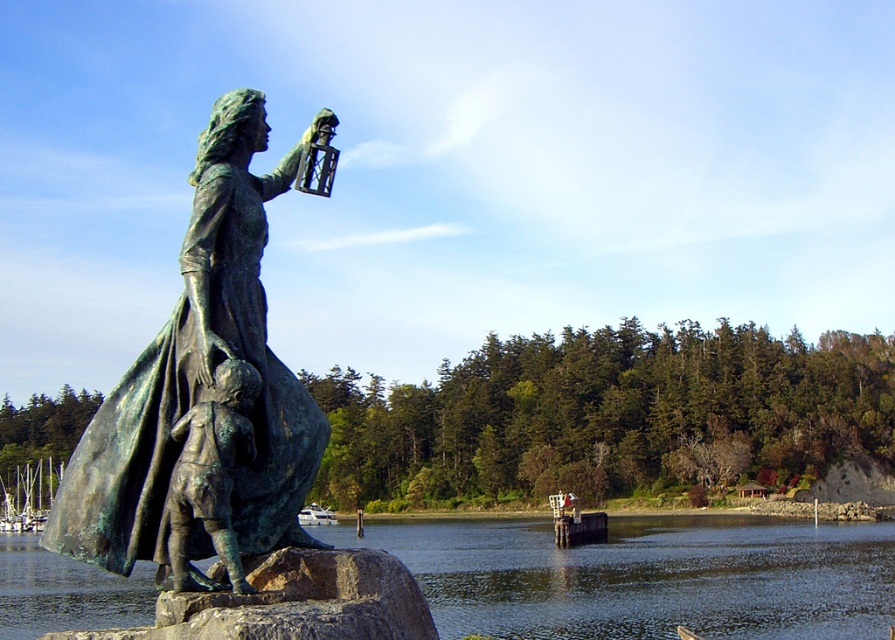
Does greenish reflective water at lower center appear under bronze statue child at lower left?

Yes, greenish reflective water at lower center is below bronze statue child at lower left.

Is greenish reflective water at lower center bigger than bronze statue child at lower left?

Indeed, greenish reflective water at lower center has a larger size compared to bronze statue child at lower left.

Does point (833, 536) come farther from viewer compared to point (229, 436)?

Yes, it is behind point (229, 436).

The width and height of the screenshot is (895, 640). What are the coordinates of `greenish reflective water at lower center` in the screenshot? It's located at (646, 577).

Is point (236, 273) behind point (240, 378)?

Yes, point (236, 273) is behind point (240, 378).

Between point (210, 493) and point (199, 467), which one is positioned behind?

Point (199, 467)

Who is more distant from viewer, (237, 193) or (202, 476)?

Point (237, 193)

You are a GUI agent. You are given a task and a screenshot of the screen. Output one action in this format:
    pyautogui.click(x=<x>, y=<y>)
    Task: Click on the green patina statue at center
    This screenshot has height=640, width=895.
    Given the screenshot: What is the action you would take?
    (x=203, y=396)

Can you confirm if brushed metal boats at left is taller than white glossy boat at center?

No.

Can you confirm if brushed metal boats at left is positioned to the right of white glossy boat at center?

Incorrect, brushed metal boats at left is not on the right side of white glossy boat at center.

The height and width of the screenshot is (640, 895). Describe the element at coordinates (28, 497) in the screenshot. I see `brushed metal boats at left` at that location.

The height and width of the screenshot is (640, 895). I want to click on brushed metal boats at left, so click(28, 497).